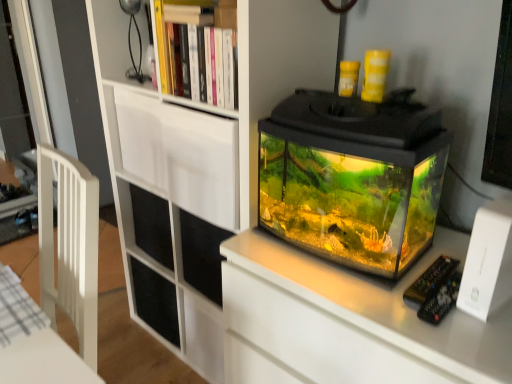
Question: Is transparent glass tank at center outside white matte bookcase at upper center?

Choices:
 (A) no
 (B) yes

Answer: (B)

Question: Can you confirm if transparent glass tank at center is taller than white matte bookcase at upper center?

Choices:
 (A) yes
 (B) no

Answer: (B)

Question: Is transparent glass tank at center surrounding white matte bookcase at upper center?

Choices:
 (A) no
 (B) yes

Answer: (A)

Question: Does transparent glass tank at center appear on the left side of white matte bookcase at upper center?

Choices:
 (A) yes
 (B) no

Answer: (B)

Question: From the image's perspective, is transparent glass tank at center under white matte bookcase at upper center?

Choices:
 (A) no
 (B) yes

Answer: (A)

Question: Visually, is white matte drawer at upper center positioned to the left or to the right of transparent glass tank at center?

Choices:
 (A) right
 (B) left

Answer: (B)

Question: Does point (173, 142) appear closer or farther from the camera than point (364, 195)?

Choices:
 (A) farther
 (B) closer

Answer: (B)

Question: From a real-world perspective, is white matte drawer at upper center physically located above or below transparent glass tank at center?

Choices:
 (A) above
 (B) below

Answer: (B)

Question: In terms of width, does white matte drawer at upper center look wider or thinner when compared to transparent glass tank at center?

Choices:
 (A) thin
 (B) wide

Answer: (A)

Question: From the image's perspective, is wooden bookshelf at upper center above or below transparent glass tank at center?

Choices:
 (A) above
 (B) below

Answer: (A)

Question: Based on their positions, is wooden bookshelf at upper center located to the left or right of transparent glass tank at center?

Choices:
 (A) right
 (B) left

Answer: (B)

Question: In the image, is wooden bookshelf at upper center positioned in front of or behind transparent glass tank at center?

Choices:
 (A) front
 (B) behind

Answer: (B)

Question: Looking at their shapes, would you say wooden bookshelf at upper center is wider or thinner than transparent glass tank at center?

Choices:
 (A) wide
 (B) thin

Answer: (B)

Question: Is point (190, 43) positioned closer to the camera than point (119, 34)?

Choices:
 (A) closer
 (B) farther

Answer: (A)

Question: Is wooden bookshelf at upper center wider or thinner than white matte bookcase at upper center?

Choices:
 (A) thin
 (B) wide

Answer: (A)